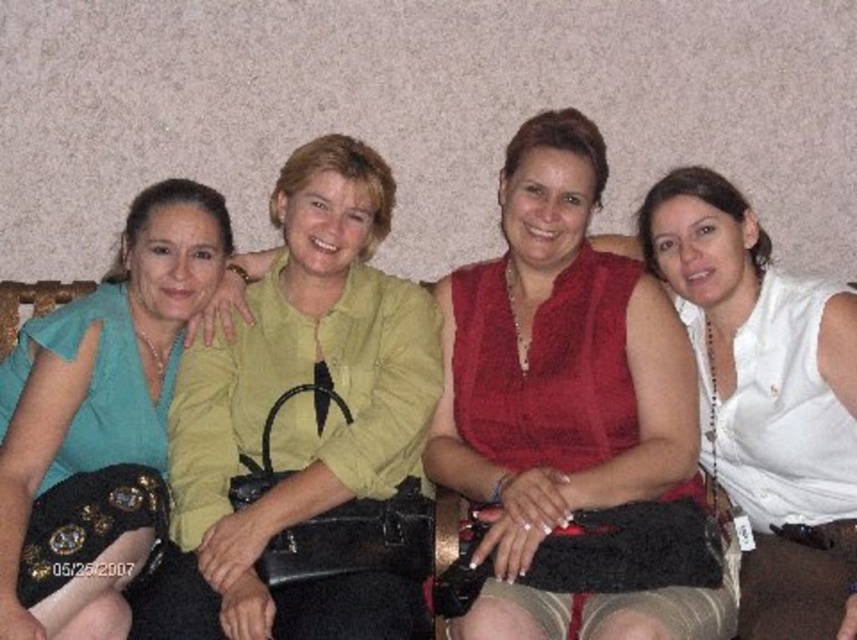
Question: Can you confirm if matte green blouse at center is thinner than teal fabric dress at left?

Choices:
 (A) yes
 (B) no

Answer: (B)

Question: Estimate the real-world distances between objects in this image. Which object is closer to the white matte tank top at center?

Choices:
 (A) teal fabric dress at left
 (B) matte red blouse at center
 (C) matte green blouse at center

Answer: (B)

Question: Is white matte tank top at center to the left of teal fabric dress at left from the viewer's perspective?

Choices:
 (A) no
 (B) yes

Answer: (A)

Question: Which point is closer to the camera taking this photo?

Choices:
 (A) (681, 262)
 (B) (27, 502)
 (C) (370, 392)
 (D) (598, 618)

Answer: (D)

Question: Can you confirm if matte red blouse at center is thinner than teal fabric dress at left?

Choices:
 (A) yes
 (B) no

Answer: (B)

Question: Which point is farther to the camera?

Choices:
 (A) teal fabric dress at left
 (B) matte red blouse at center

Answer: (A)